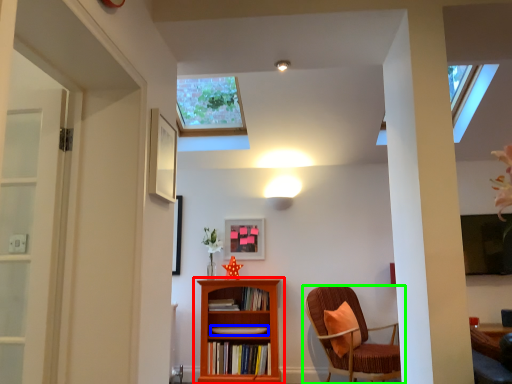
Question: Based on their relative distances, which object is nearer to bookcase (highlighted by a red box)? Choose from book (highlighted by a blue box) and chair (highlighted by a green box).

Choices:
 (A) book
 (B) chair

Answer: (A)